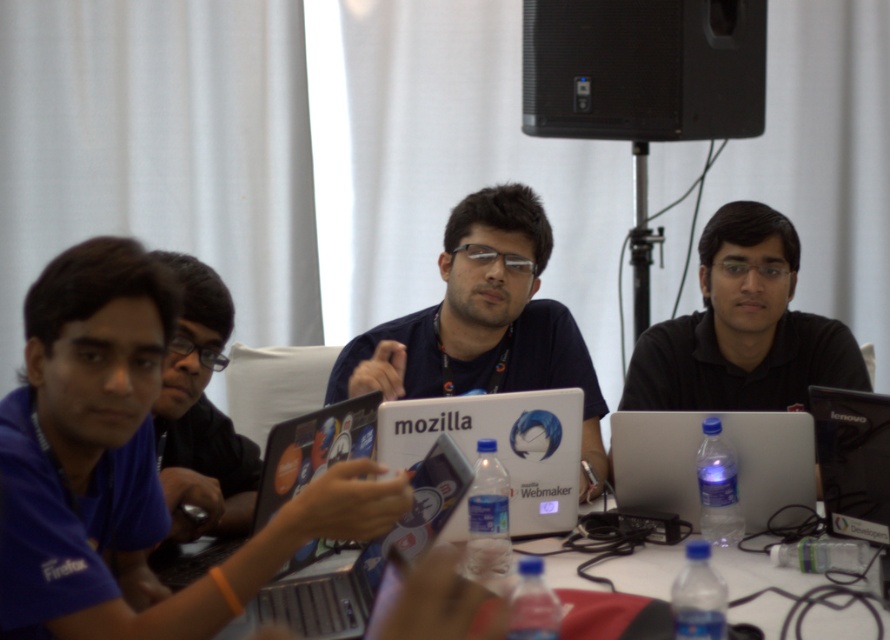
Between black matte shirt at center and matte silver laptop at center, which one is positioned lower?

Positioned lower is matte silver laptop at center.

What are the coordinates of `black matte shirt at center` in the screenshot? It's located at (742, 328).

The height and width of the screenshot is (640, 890). What do you see at coordinates (742, 328) in the screenshot?
I see `black matte shirt at center` at bounding box center [742, 328].

Locate an element on the screen. This screenshot has height=640, width=890. black matte shirt at center is located at coordinates coord(742,328).

Between point (356, 561) and point (843, 461), which one is positioned in front?

Point (356, 561) is in front.

Is metallic silver laptop at center bigger than black plastic laptop at lower right?

Yes.

You are a GUI agent. You are given a task and a screenshot of the screen. Output one action in this format:
    pyautogui.click(x=<x>, y=<y>)
    Task: Click on the metallic silver laptop at center
    This screenshot has height=640, width=890.
    Given the screenshot: What is the action you would take?
    pyautogui.click(x=363, y=560)

How far apart are black matte shirt at center and shiny black laptop at center?

black matte shirt at center is 39.13 inches from shiny black laptop at center.

Between point (664, 360) and point (329, 456), which one is positioned behind?

The point (664, 360) is behind.

Which is behind, point (774, 337) or point (313, 412)?

The point (774, 337) is more distant.

In order to click on black matte shirt at center in this screenshot , I will do `click(742, 328)`.